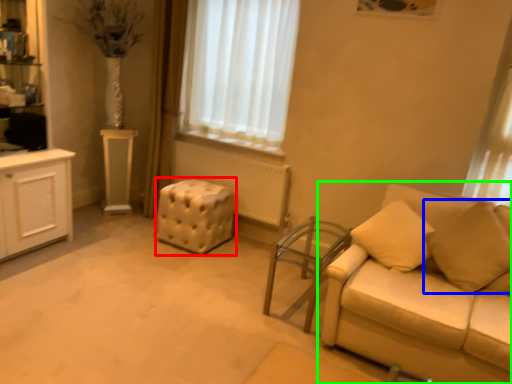
Question: Which object is positioned closest to stool (highlighted by a red box)? Select from pillow (highlighted by a blue box) and studio couch (highlighted by a green box).

Choices:
 (A) pillow
 (B) studio couch

Answer: (B)